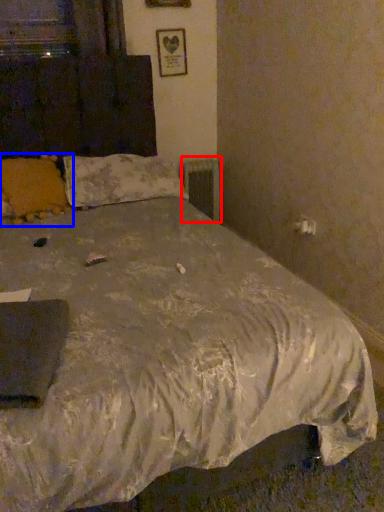
Question: Which of the following is the farthest to the observer, radiator (highlighted by a red box) or pillow (highlighted by a blue box)?

Choices:
 (A) radiator
 (B) pillow

Answer: (A)